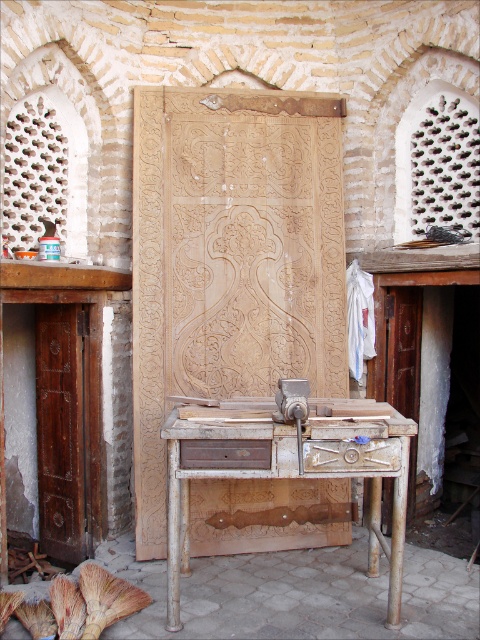
You are organizing tools in the workshop and need to place a new tool box. You see the brushed wood drawer at center and the brown wood drawer at center. Which drawer is on the right side when facing the workbench?

The brushed wood drawer at center is positioned on the right side of brown wood drawer at center, so when facing the workbench, the brushed wood drawer at center is on the right side.

You are an apprentice in the workshop and need to place a new tool on the work surface. Where should you put it to ensure it stays on the rusty metal workbench at center and not the brown wood drawer at center?

Place the tool on the right side of the work surface since the rusty metal workbench at center is positioned to the right of the brown wood drawer at center, ensuring it stays on the workbench rather than the drawer.

You are a carpenter who needs to move a small piece of wood from the rusty metal workbench at center to the large wooden panel leaning against the wall. The carpenter can carry the wood in their hands. What is the minimum distance they need to walk to complete this task?

The minimum distance the carpenter needs to walk is 9.57 feet, which is the distance between the rusty metal workbench at center and the large wooden panel leaning against the wall.